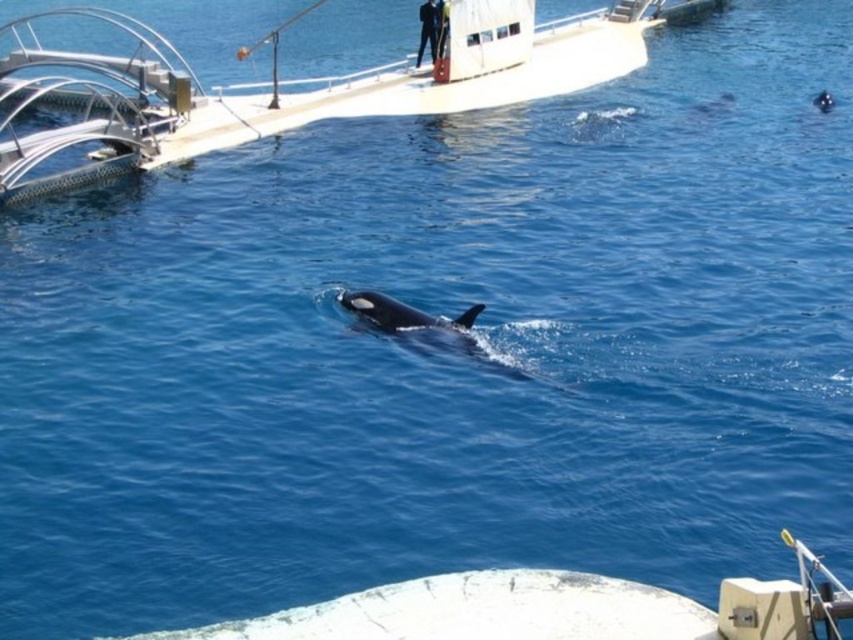
Can you confirm if white glossy boat at upper center is bigger than black smooth whale at center?

Indeed, white glossy boat at upper center has a larger size compared to black smooth whale at center.

In the scene shown: Who is lower down, white glossy boat at upper center or black smooth whale at center?

black smooth whale at center is below.

Who is more distant from viewer, (103, 97) or (503, 372)?

The point (103, 97) is behind.

This screenshot has width=853, height=640. In order to click on white glossy boat at upper center in this screenshot , I will do `click(289, 84)`.